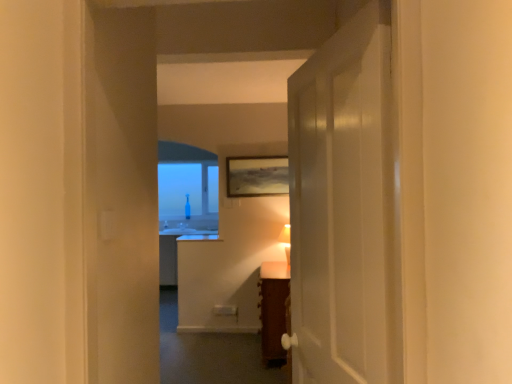
Question: Is matte white table lamp at center in front of or behind wooden textured picture frame at center in the image?

Choices:
 (A) behind
 (B) front

Answer: (B)

Question: In terms of height, does matte white table lamp at center look taller or shorter compared to wooden textured picture frame at center?

Choices:
 (A) tall
 (B) short

Answer: (B)

Question: Which of these objects is positioned closest to the white glossy door at center?

Choices:
 (A) wooden textured picture frame at center
 (B) matte white table lamp at center
 (C) transparent glass bottle at center
 (D) wooden cabinet at center

Answer: (D)

Question: Considering the real-world distances, which object is farthest from the transparent glass bottle at center?

Choices:
 (A) wooden cabinet at center
 (B) wooden textured picture frame at center
 (C) white glossy door at center
 (D) matte white table lamp at center

Answer: (C)